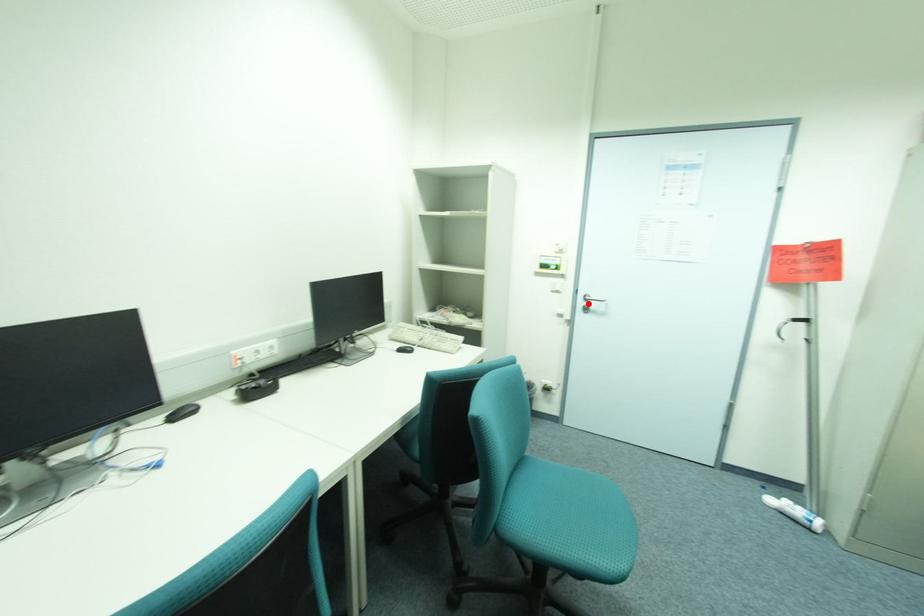
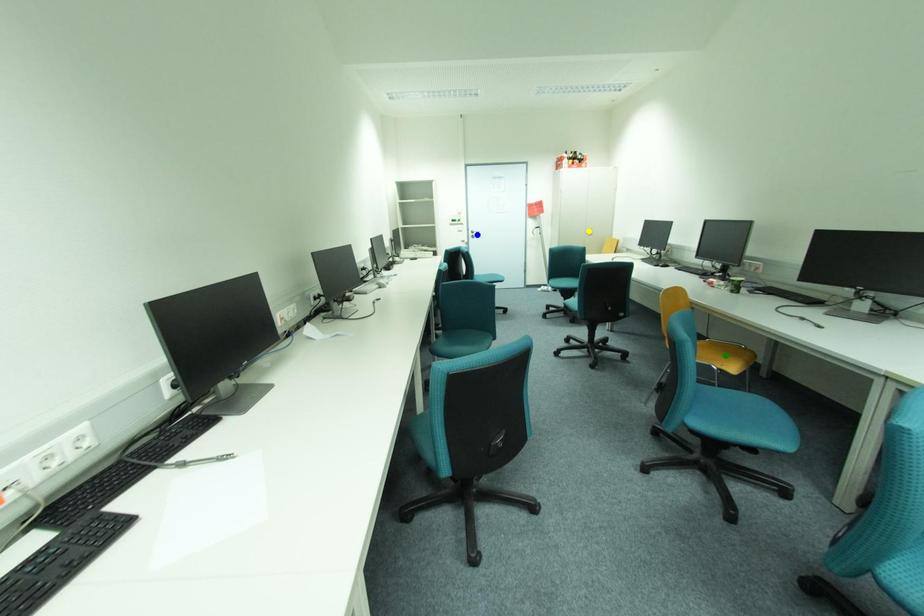
Question: I am providing you with two images of the same scene from different viewpoints. A red point is marked on the first image. You are given multiple points on the second image. Which mark in image 2 goes with the point in image 1?

Choices:
 (A) yellow point
 (B) blue point
 (C) green point

Answer: (B)